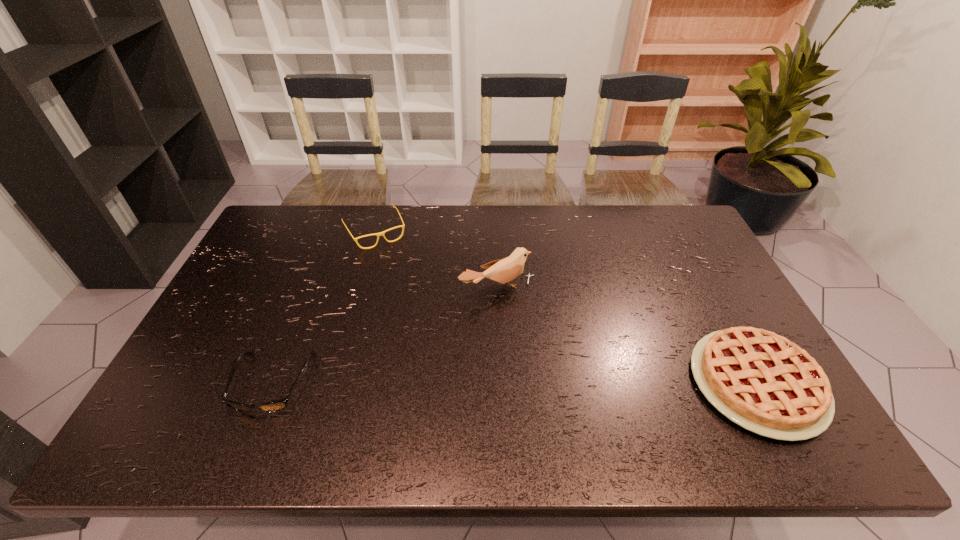
Image resolution: width=960 pixels, height=540 pixels. Find the location of `vacant space on the desktop that is between the nearer spectacles and the rightmost object and is positioned at the beak of the third object from left to right`. vacant space on the desktop that is between the nearer spectacles and the rightmost object and is positioned at the beak of the third object from left to right is located at coordinates (566, 383).

You are a GUI agent. You are given a task and a screenshot of the screen. Output one action in this format:
    pyautogui.click(x=<x>, y=<y>)
    Task: Click on the vacant spot on the desktop that is between the nearer spectacles and the rightmost object and is positioned in front of the lenses of the farthest object
    Image resolution: width=960 pixels, height=540 pixels.
    Given the screenshot: What is the action you would take?
    pyautogui.click(x=454, y=383)